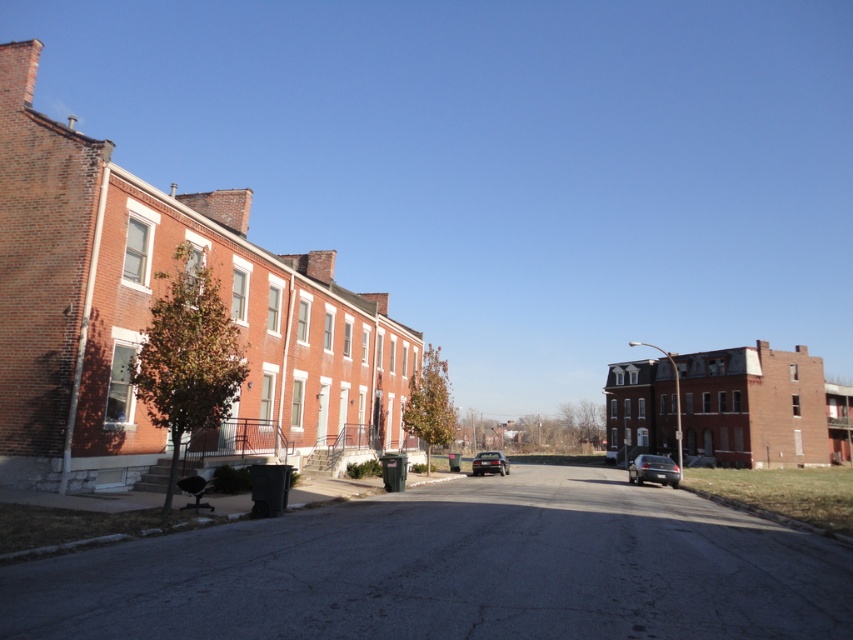
You are standing at the center of the street and want to park your car, which is 4.5 meters long, in the available space near the point marked at coordinates (653, 468). Can your car fit there?

The available parking space at point (653, 468) can accommodate a car of 4.5 meters in length since the satin silver sedan at center right currently occupying it is of similar size.